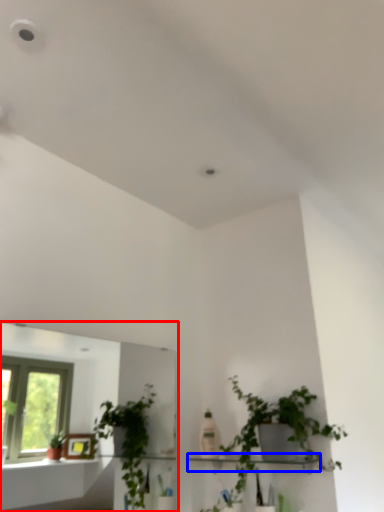
Question: Which point is further to the camera, mirror (highlighted by a red box) or shelf (highlighted by a blue box)?

Choices:
 (A) mirror
 (B) shelf

Answer: (B)